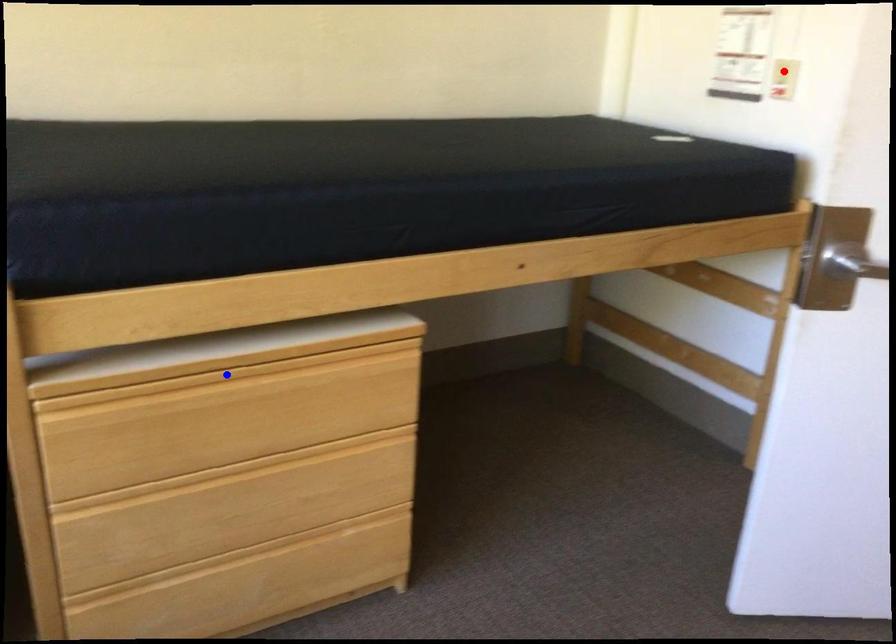
Question: Two points are marked on the image. Which point is closer to the camera?

Choices:
 (A) Blue point is closer.
 (B) Red point is closer.

Answer: (A)